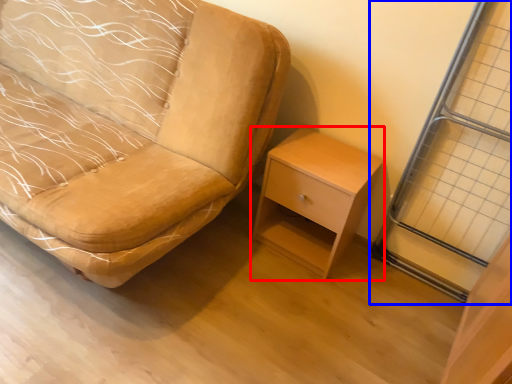
Question: Which point is closer to the camera, nightstand (highlighted by a red box) or screen door (highlighted by a blue box)?

Choices:
 (A) nightstand
 (B) screen door

Answer: (B)